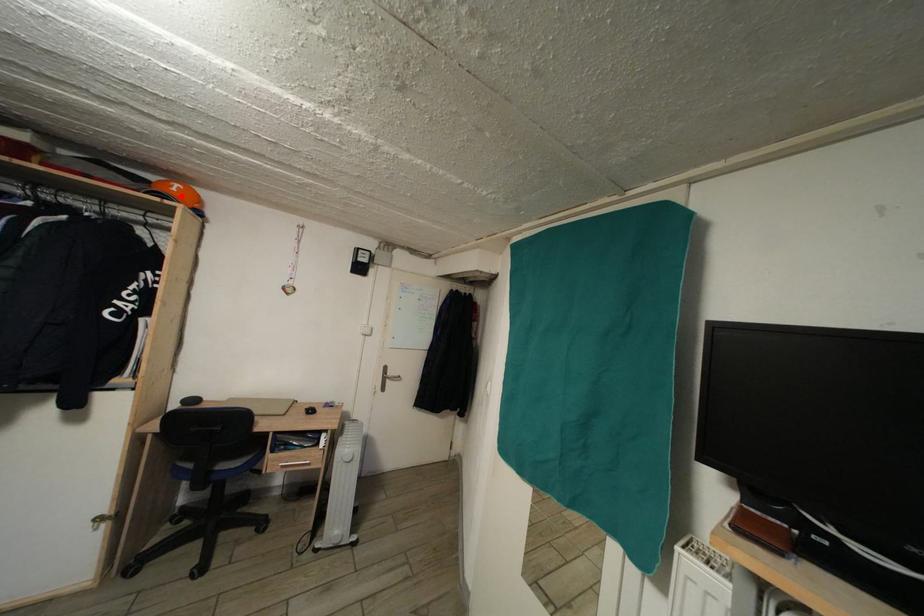
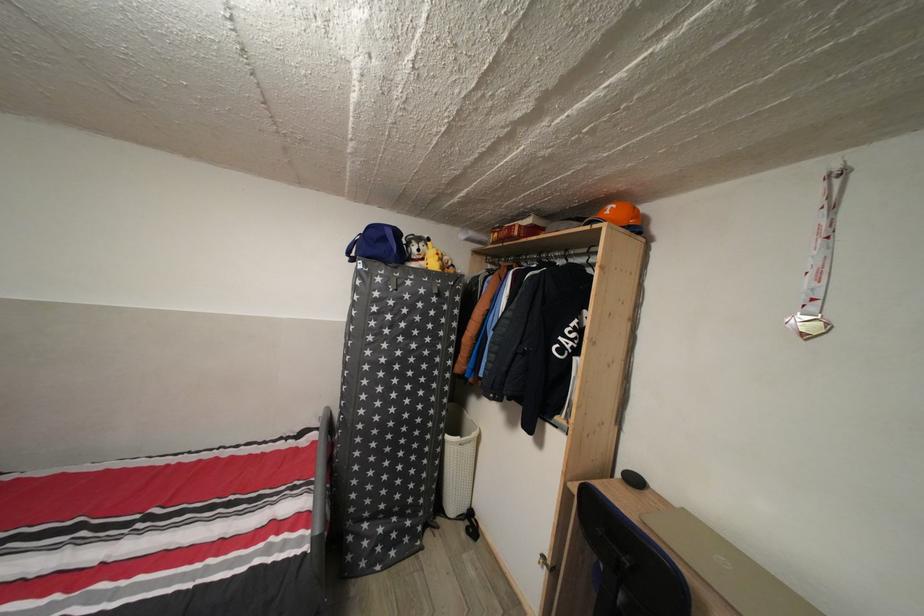
Find the pixel in the second image that matches the highlighted location in the first image.

(614, 219)